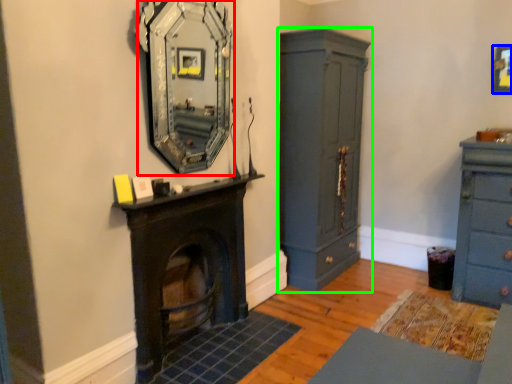
Question: Which object is positioned closest to mirror (highlighted by a red box)? Select from picture frame (highlighted by a blue box) and cupboard (highlighted by a green box).

Choices:
 (A) picture frame
 (B) cupboard

Answer: (B)